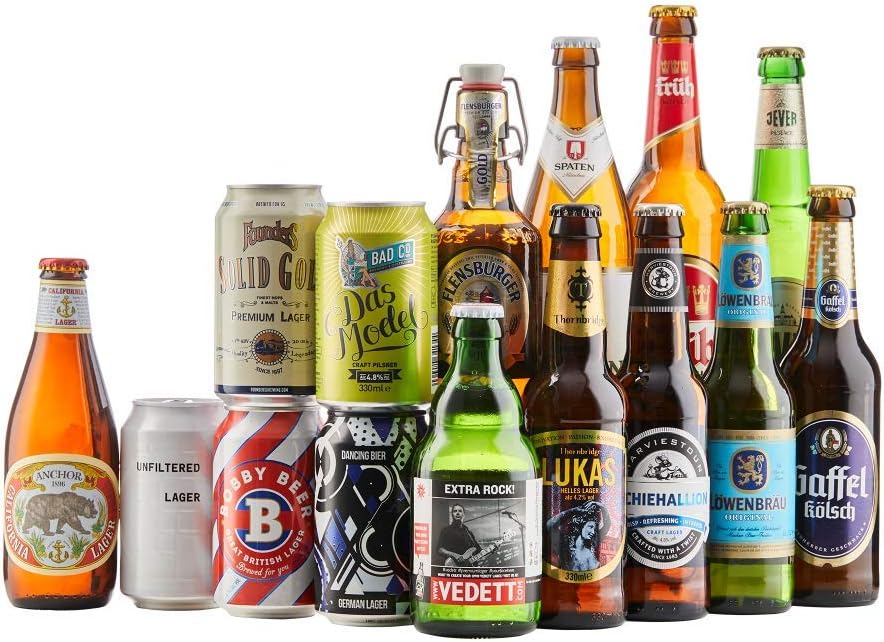
I want to click on bottles, so click(x=42, y=415), click(x=490, y=474), click(x=494, y=269), click(x=574, y=324), click(x=652, y=309), click(x=737, y=316), click(x=840, y=306), click(x=779, y=148), click(x=674, y=116), click(x=583, y=137).